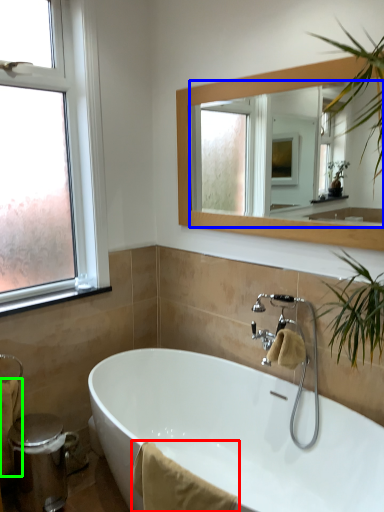
Question: Which object is the closest to the bath towel (highlighted by a red box)? Choose among these: mirror (highlighted by a blue box) or bath towel (highlighted by a green box).

Choices:
 (A) mirror
 (B) bath towel

Answer: (B)